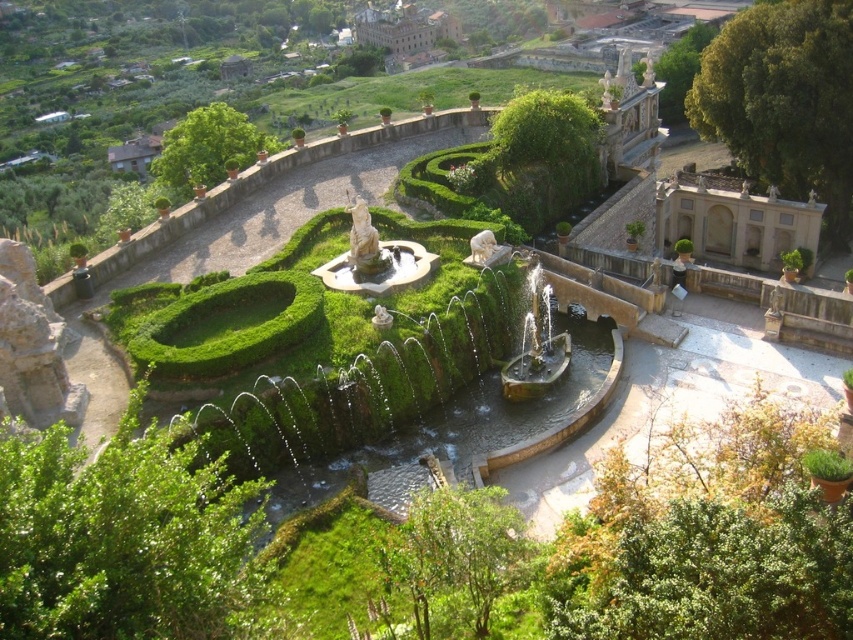
Question: Among these objects, which one is farthest from the camera?

Choices:
 (A) white marble statue at center
 (B) green leafy bush at lower left

Answer: (A)

Question: Is green leafy bush at lower center to the right of green leafy bush at upper left from the viewer's perspective?

Choices:
 (A) yes
 (B) no

Answer: (A)

Question: Which object is closer to the camera taking this photo?

Choices:
 (A) green leafy bush at center right
 (B) green leafy bush at lower center
 (C) green leafy bush at upper left
 (D) green leafy bush at lower left

Answer: (D)

Question: Which of the following is the closest to the observer?

Choices:
 (A) brown stone palace at upper center
 (B) green leafy bush at lower center

Answer: (B)

Question: Is green leafy bush at lower left positioned at the back of brown stone palace at upper center?

Choices:
 (A) no
 (B) yes

Answer: (A)

Question: Is green leafy bush at lower left positioned at the back of white marble statue at center?

Choices:
 (A) no
 (B) yes

Answer: (A)